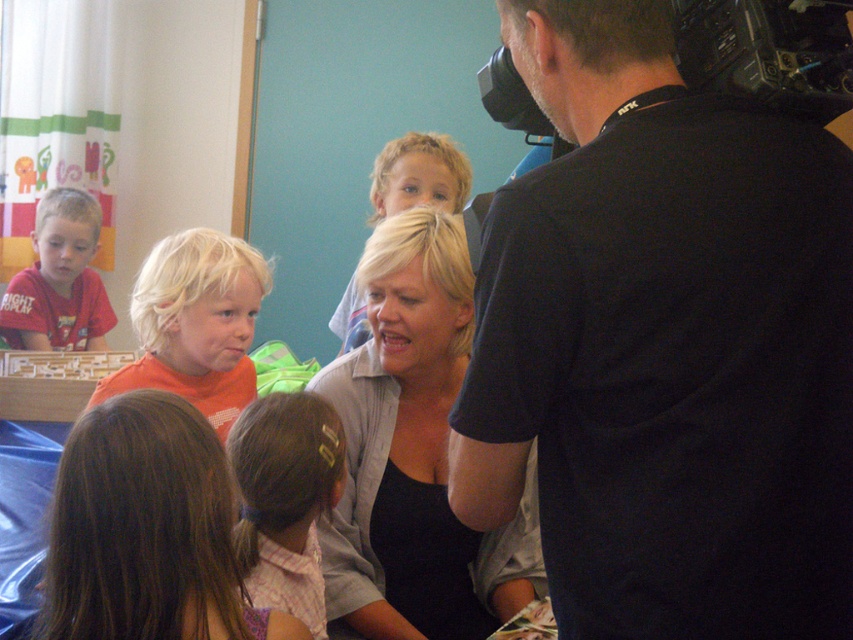
Question: Among these objects, which one is farthest from the camera?

Choices:
 (A) blonde hair at center
 (B) black matte shirt at center
 (C) pink plaid shirt at center
 (D) matte red shirt at left

Answer: (D)

Question: Can you confirm if orange matte shirt at center is positioned to the right of blonde hair at center?

Choices:
 (A) yes
 (B) no

Answer: (B)

Question: Which object is closer to the camera taking this photo?

Choices:
 (A) brown hair at lower left
 (B) black matte shirt at center
 (C) pink plaid shirt at center
 (D) matte red shirt at left

Answer: (A)

Question: Which object is the closest to the brown hair at lower left?

Choices:
 (A) black matte shirt at center
 (B) orange matte shirt at center
 (C) pink plaid shirt at center
 (D) black fabric shirt at upper right

Answer: (C)

Question: Does black fabric shirt at upper right appear on the right side of pink plaid shirt at center?

Choices:
 (A) yes
 (B) no

Answer: (A)

Question: Is orange matte shirt at center above pink plaid shirt at center?

Choices:
 (A) yes
 (B) no

Answer: (A)